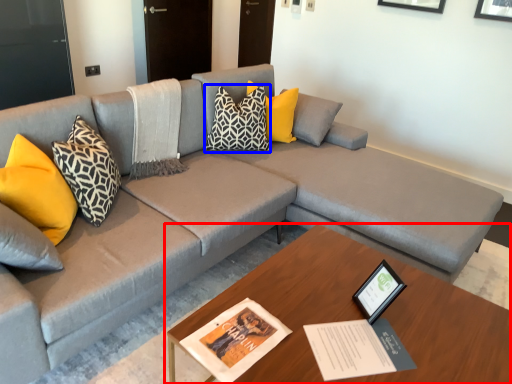
Question: Among these objects, which one is nearest to the camera, table (highlighted by a red box) or pillow (highlighted by a blue box)?

Choices:
 (A) table
 (B) pillow

Answer: (A)